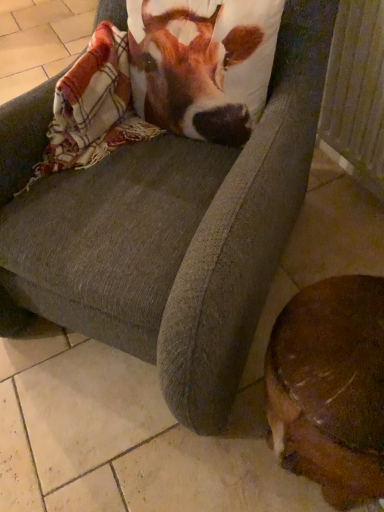
Question: Is point (360, 152) positioned closer to the camera than point (137, 10)?

Choices:
 (A) farther
 (B) closer

Answer: (A)

Question: Is wooden radiator at lower right situated inside brown and white fabric at upper center or outside?

Choices:
 (A) outside
 (B) inside

Answer: (A)

Question: Estimate the real-world distances between objects in this image. Which object is closer to the wooden radiator at lower right?

Choices:
 (A) plaid woolen blanket at upper left
 (B) brown furry dog at lower right
 (C) brown and white fabric at upper center

Answer: (C)

Question: Which object is positioned farthest from the wooden radiator at lower right?

Choices:
 (A) plaid woolen blanket at upper left
 (B) brown furry dog at lower right
 (C) brown and white fabric at upper center

Answer: (B)